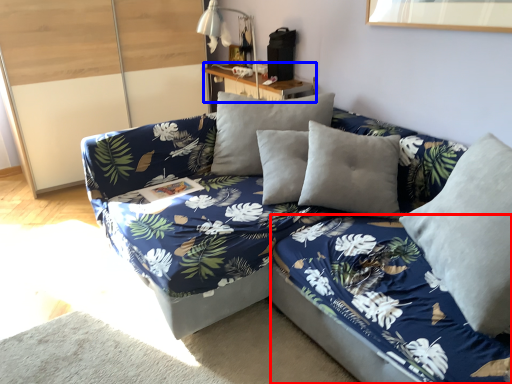
Question: Which object appears closest to the camera in this image, bed frame (highlighted by a red box) or table (highlighted by a blue box)?

Choices:
 (A) bed frame
 (B) table

Answer: (A)